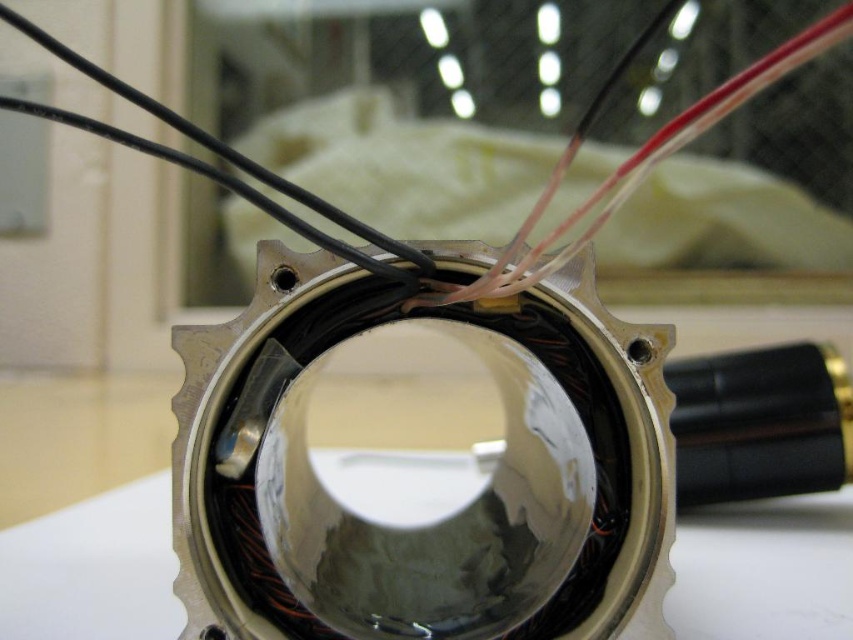
Can you confirm if shiny metallic lens at center is shorter than black wire at center?

In fact, shiny metallic lens at center may be taller than black wire at center.

Does shiny metallic lens at center appear over black wire at center?

No.

The image size is (853, 640). I want to click on shiny metallic lens at center, so click(x=421, y=465).

Locate an element on the screen. Image resolution: width=853 pixels, height=640 pixels. shiny metallic lens at center is located at coordinates (421, 465).